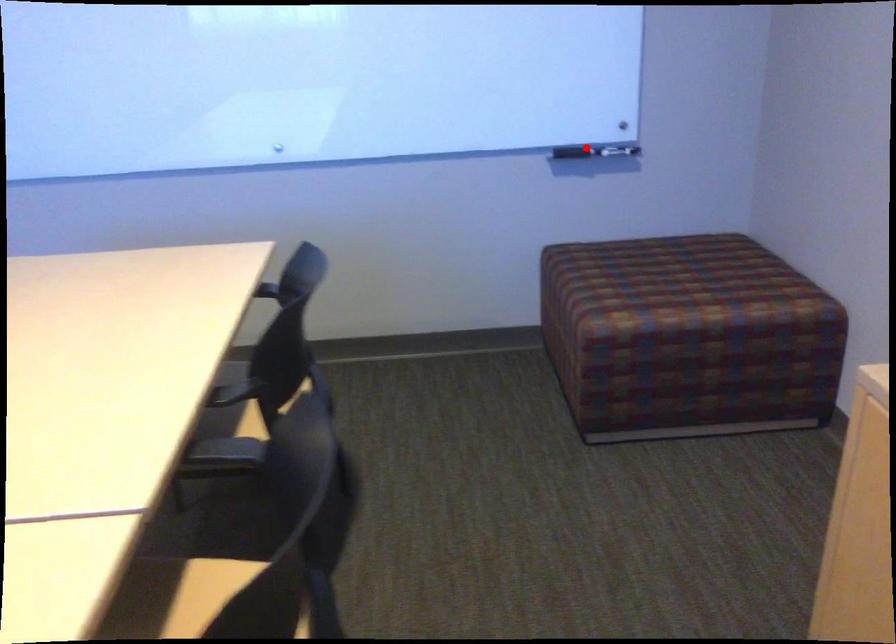
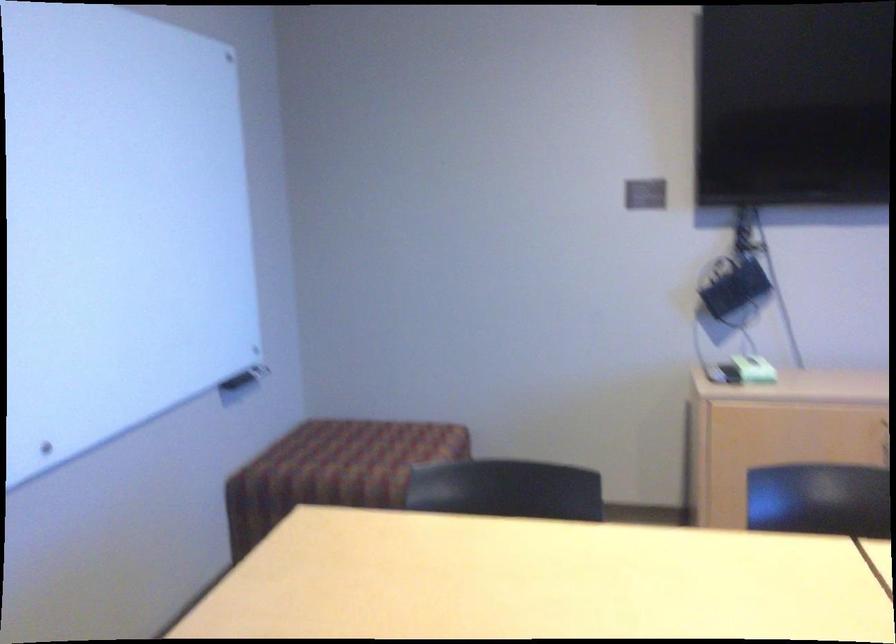
Where in the second image is the point corresponding to the highlighted location from the first image?

(246, 373)